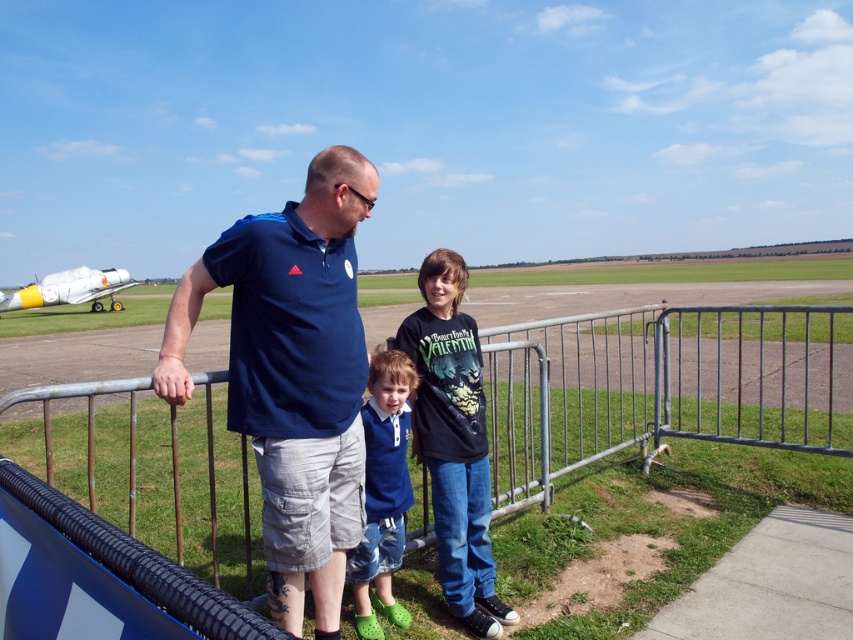
Question: Is black matte shirt at center positioned before white glossy airplane at left?

Choices:
 (A) no
 (B) yes

Answer: (B)

Question: Does metallic silver fence at center have a larger size compared to matte blue shirt at center?

Choices:
 (A) yes
 (B) no

Answer: (A)

Question: Can you confirm if metallic silver fence at center is smaller than blue fabric shirt at center?

Choices:
 (A) yes
 (B) no

Answer: (B)

Question: Which object is closer to the camera taking this photo?

Choices:
 (A) matte blue shirt at center
 (B) blue fabric shirt at center
 (C) metallic silver fence at center

Answer: (A)

Question: Considering the real-world distances, which object is farthest from the matte blue shirt at center?

Choices:
 (A) black matte shirt at center
 (B) metallic silver fence at center
 (C) white glossy airplane at left

Answer: (C)

Question: Which point is closer to the camera?

Choices:
 (A) metallic silver fence at center
 (B) white glossy airplane at left

Answer: (A)